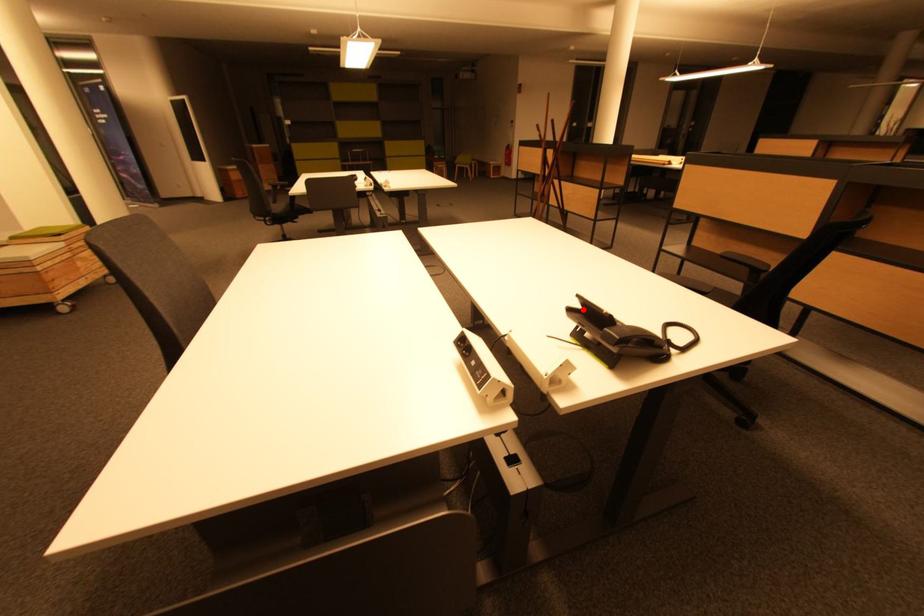
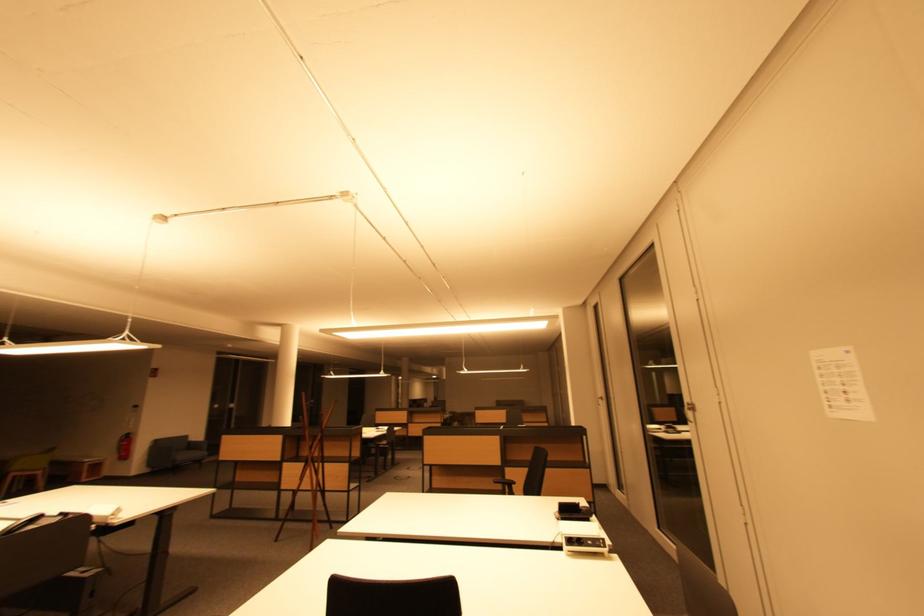
The point at the highlighted location is marked in the first image. Where is the corresponding point in the second image?

(563, 512)